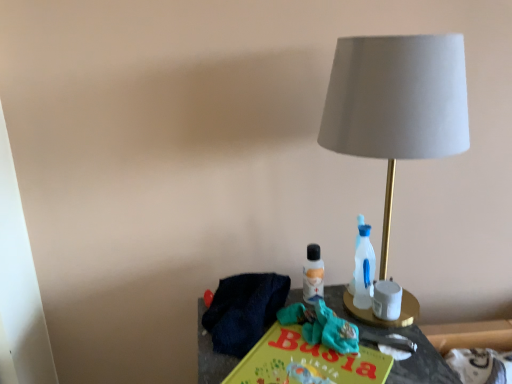
Where is `vacant area that is in front of white matte candle holder at right`? vacant area that is in front of white matte candle holder at right is located at coordinates (396, 357).